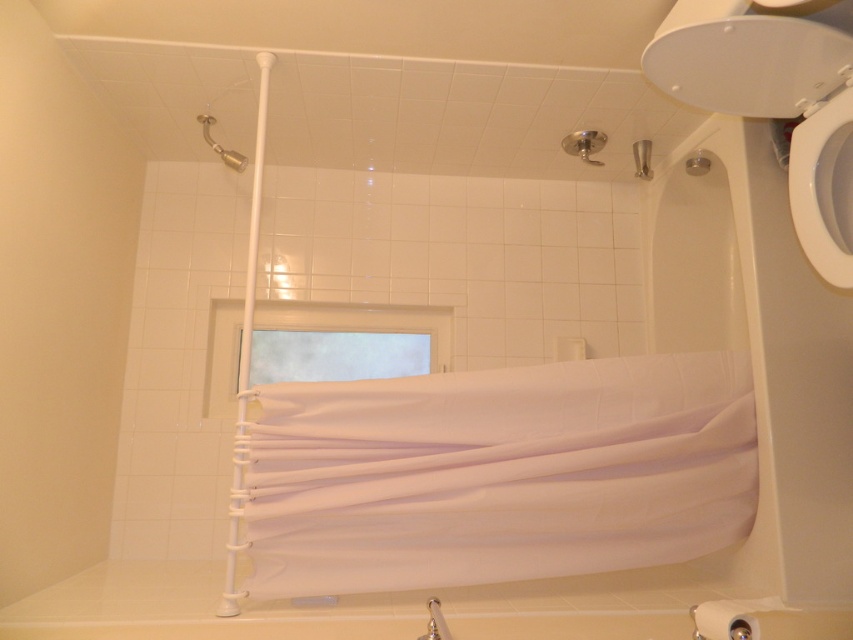
Which is in front, point (819, 220) or point (724, 637)?

Point (724, 637)

Is white glossy toilet bowl at right bigger than silver metallic towel bar at lower right?

Actually, white glossy toilet bowl at right might be smaller than silver metallic towel bar at lower right.

Is point (817, 266) in front of point (741, 608)?

No, (817, 266) is further to viewer.

Where is `white glossy toilet bowl at right`? The image size is (853, 640). white glossy toilet bowl at right is located at coordinates (824, 188).

Who is higher up, white fabric curtain at center or metallic silver showerhead at upper center?

metallic silver showerhead at upper center is higher up.

Is white fabric curtain at center positioned at the back of metallic silver showerhead at upper center?

No, it is not.

What do you see at coordinates (498, 474) in the screenshot? I see `white fabric curtain at center` at bounding box center [498, 474].

Identify the location of white fabric curtain at center. The width and height of the screenshot is (853, 640). click(498, 474).

This screenshot has height=640, width=853. What do you see at coordinates (335, 355) in the screenshot? I see `transparent glass window at upper center` at bounding box center [335, 355].

Is transparent glass window at upper center smaller than metallic showerhead at upper left?

Incorrect, transparent glass window at upper center is not smaller in size than metallic showerhead at upper left.

Which is behind, point (389, 371) or point (206, 134)?

The point (389, 371) is more distant.

Find the location of a particular element. Image resolution: width=853 pixels, height=640 pixels. transparent glass window at upper center is located at coordinates (335, 355).